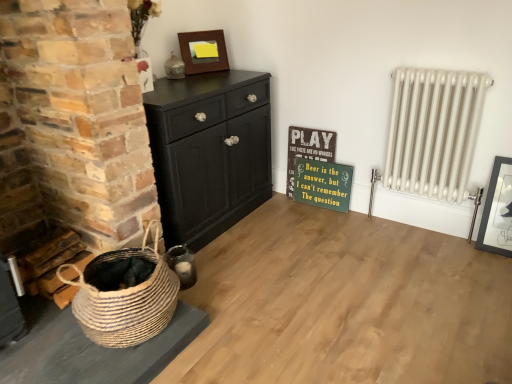
I want to click on free location in front of white metal radiator at right, so click(x=437, y=261).